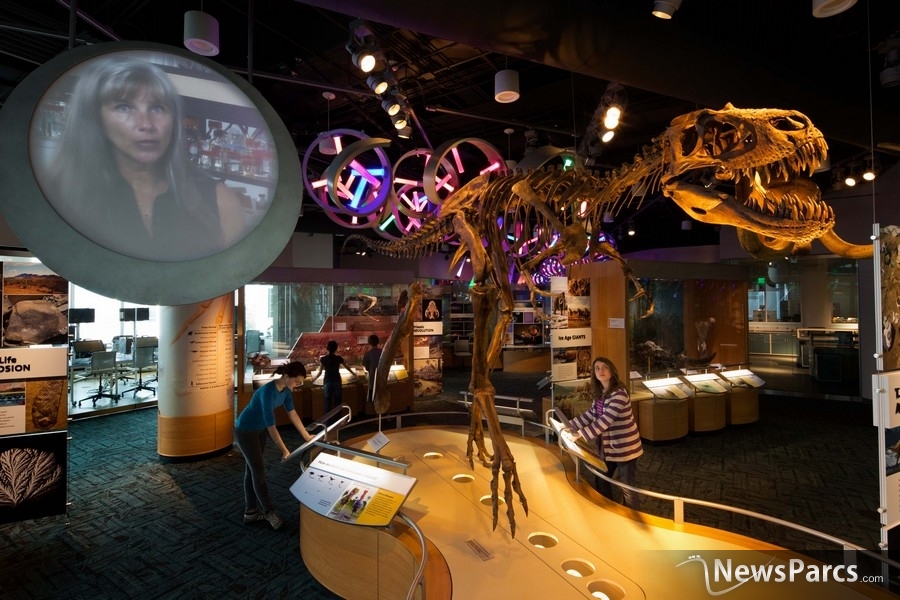
The height and width of the screenshot is (600, 900). I want to click on screen, so click(x=153, y=171).